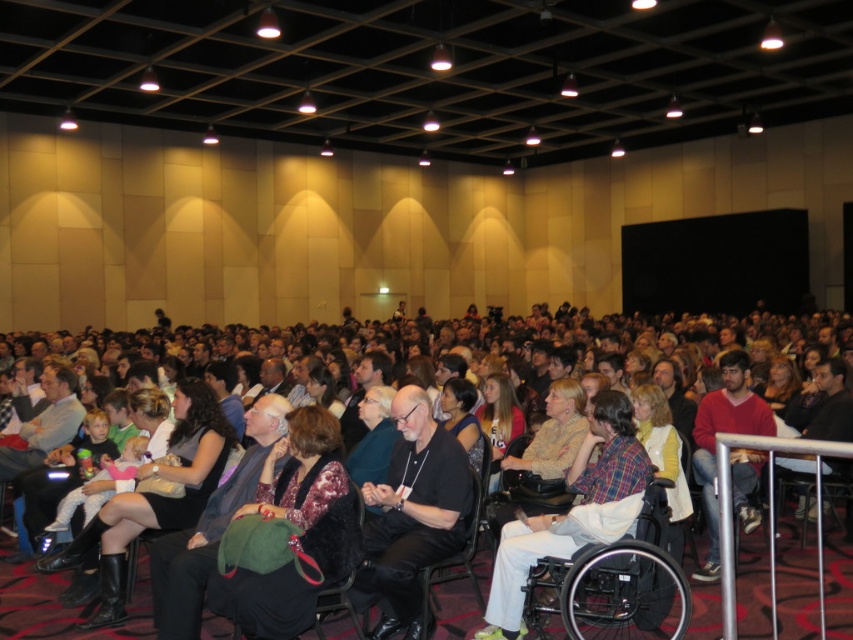
Does black matte shirt at center have a larger size compared to red sweater at center?

Actually, black matte shirt at center might be smaller than red sweater at center.

Measure the distance between point (415, 451) and camera.

Point (415, 451) and camera are 4.11 meters apart from each other.

Where is `black matte shirt at center`? This screenshot has width=853, height=640. black matte shirt at center is located at coordinates (412, 513).

Can you confirm if white plastic wheelchair at lower center is wider than red sweater at center?

Yes.

Is point (637, 534) in front of point (752, 472)?

Yes, it is in front of point (752, 472).

What do you see at coordinates (616, 582) in the screenshot? This screenshot has width=853, height=640. I see `white plastic wheelchair at lower center` at bounding box center [616, 582].

This screenshot has height=640, width=853. I want to click on white plastic wheelchair at lower center, so click(616, 582).

Is black matte shirt at center behind white plastic wheelchair at lower center?

Yes, black matte shirt at center is further from the viewer.

Who is more forward, [432,438] or [581,582]?

Point [581,582]

Locate an element on the screen. This screenshot has width=853, height=640. black matte shirt at center is located at coordinates (412, 513).